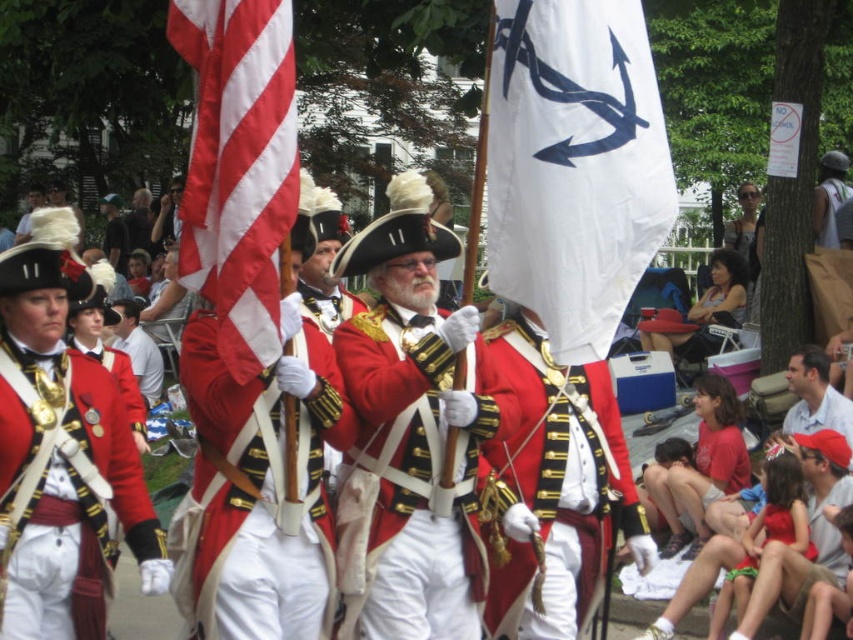
Is shiny red fabric at center thinner than shiny gold buttons at center?

In fact, shiny red fabric at center might be wider than shiny gold buttons at center.

You are a GUI agent. You are given a task and a screenshot of the screen. Output one action in this format:
    pyautogui.click(x=<x>, y=<y>)
    Task: Click on the shiny red fabric at center
    The image size is (853, 640).
    Given the screenshot: What is the action you would take?
    pyautogui.click(x=258, y=490)

Between white fabric flag with navy blue anchor at center and shiny gold medallion at center, which one has less height?

Standing shorter between the two is white fabric flag with navy blue anchor at center.

Can you confirm if white fabric flag with navy blue anchor at center is thinner than shiny gold medallion at center?

Indeed, white fabric flag with navy blue anchor at center has a lesser width compared to shiny gold medallion at center.

What do you see at coordinates (573, 164) in the screenshot?
I see `white fabric flag with navy blue anchor at center` at bounding box center [573, 164].

Where is `white fabric flag with navy blue anchor at center`? white fabric flag with navy blue anchor at center is located at coordinates (573, 164).

Between shiny red fabric at center and red/white striped fabric at left, which one has less height?

shiny red fabric at center is shorter.

The width and height of the screenshot is (853, 640). Describe the element at coordinates (258, 490) in the screenshot. I see `shiny red fabric at center` at that location.

I want to click on shiny red fabric at center, so click(x=258, y=490).